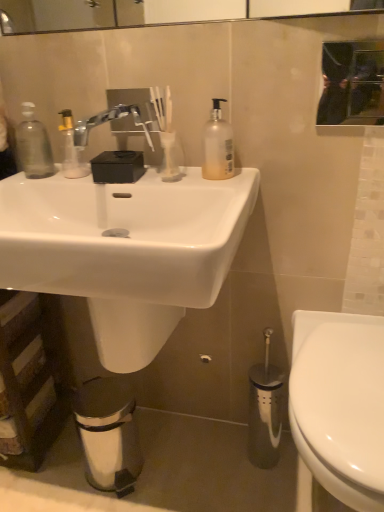
I want to click on free region under white glossy sink at center (from a real-world perspective), so click(160, 463).